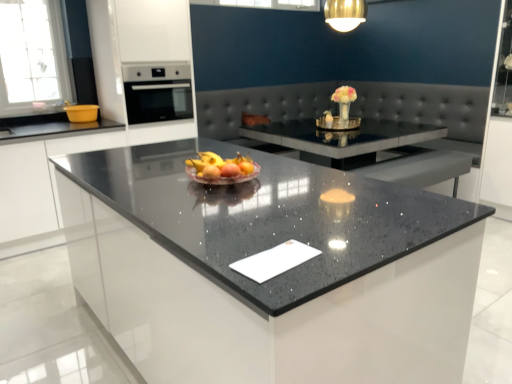
Locate an element on the screen. This screenshot has height=384, width=512. vacant point to the left of translucent glass bowl at center is located at coordinates (146, 177).